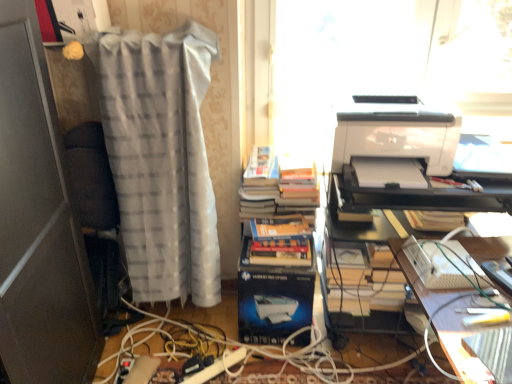
Question: Considering the relative sizes of hardcover books at center and white glossy printer at right in the image provided, is hardcover books at center smaller than white glossy printer at right?

Choices:
 (A) no
 (B) yes

Answer: (A)

Question: Considering the relative positions of hardcover books at center and white glossy printer at right in the image provided, is hardcover books at center to the right of white glossy printer at right from the viewer's perspective?

Choices:
 (A) yes
 (B) no

Answer: (B)

Question: From a real-world perspective, does hardcover books at center sit lower than white glossy printer at right?

Choices:
 (A) yes
 (B) no

Answer: (A)

Question: Is hardcover books at center looking in the opposite direction of white glossy printer at right?

Choices:
 (A) yes
 (B) no

Answer: (B)

Question: From a real-world perspective, is hardcover books at center positioned over white glossy printer at right based on gravity?

Choices:
 (A) yes
 (B) no

Answer: (B)

Question: Based on their positions, is wooden desk at lower right located to the left or right of white plastic keyboard at lower right, which ranks as the 2th equipment in right-to-left order?

Choices:
 (A) left
 (B) right

Answer: (B)

Question: Considering their positions, is wooden desk at lower right located in front of or behind white plastic keyboard at lower right, which ranks as the 2th equipment in right-to-left order?

Choices:
 (A) behind
 (B) front

Answer: (B)

Question: From a real-world perspective, is wooden desk at lower right physically located above or below white plastic keyboard at lower right, which ranks as the 2th equipment in right-to-left order?

Choices:
 (A) above
 (B) below

Answer: (B)

Question: Is wooden desk at lower right wider or thinner than white plastic keyboard at lower right, which ranks as the 2th equipment in right-to-left order?

Choices:
 (A) thin
 (B) wide

Answer: (B)

Question: Considering the positions of metallic silver remote control at lower right, which appears as the 1th equipment when viewed from the right, and white plastic keyboard at lower right, which ranks as the 2th equipment in right-to-left order, in the image, is metallic silver remote control at lower right, which appears as the 1th equipment when viewed from the right, bigger or smaller than white plastic keyboard at lower right, which ranks as the 2th equipment in right-to-left order,?

Choices:
 (A) small
 (B) big

Answer: (A)

Question: Is metallic silver remote control at lower right, which ranks as the second equipment in left-to-right order, situated inside white plastic keyboard at lower right, the first equipment in the left-to-right sequence, or outside?

Choices:
 (A) outside
 (B) inside

Answer: (A)

Question: From the image's perspective, is metallic silver remote control at lower right, which ranks as the second equipment in left-to-right order, above or below white plastic keyboard at lower right, which ranks as the 2th equipment in right-to-left order?

Choices:
 (A) below
 (B) above

Answer: (A)

Question: Does point (486, 266) appear closer or farther from the camera than point (438, 274)?

Choices:
 (A) closer
 (B) farther

Answer: (B)

Question: From a real-world perspective, is white glossy printer at upper right physically located above or below white glossy printer at right?

Choices:
 (A) above
 (B) below

Answer: (B)

Question: Is white glossy printer at upper right wider or thinner than white glossy printer at right?

Choices:
 (A) thin
 (B) wide

Answer: (B)